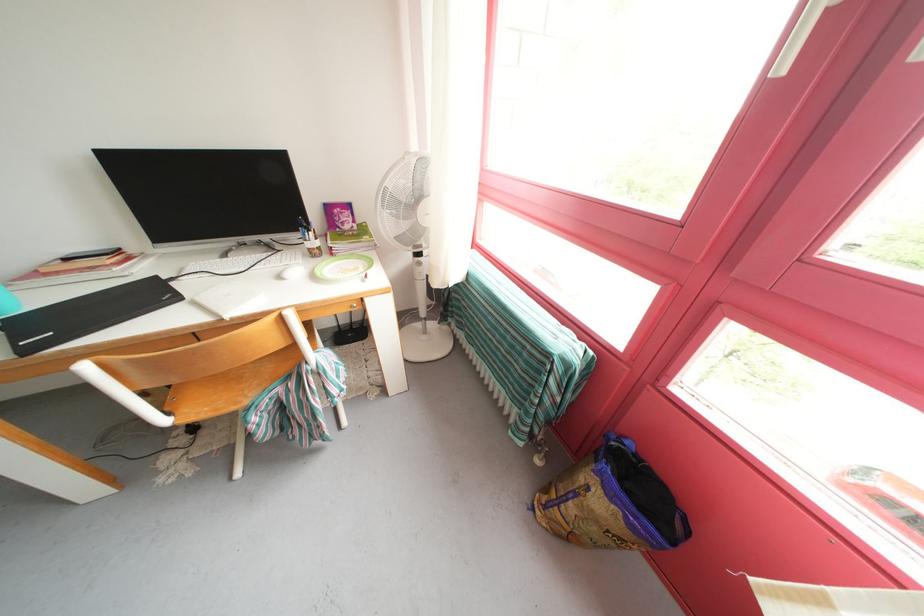
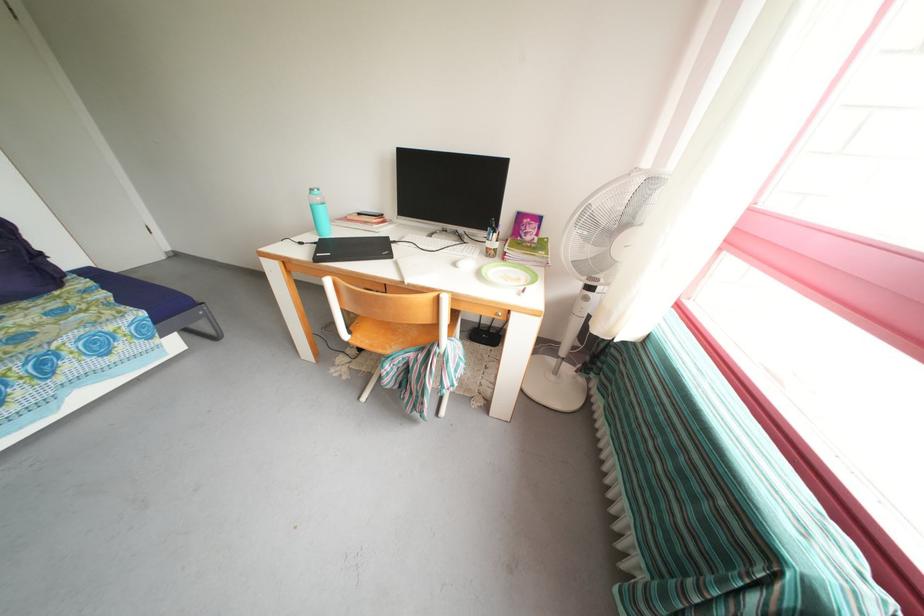
Locate, in the second image, the point that corresponds to (x=232, y=262) in the first image.

(436, 241)